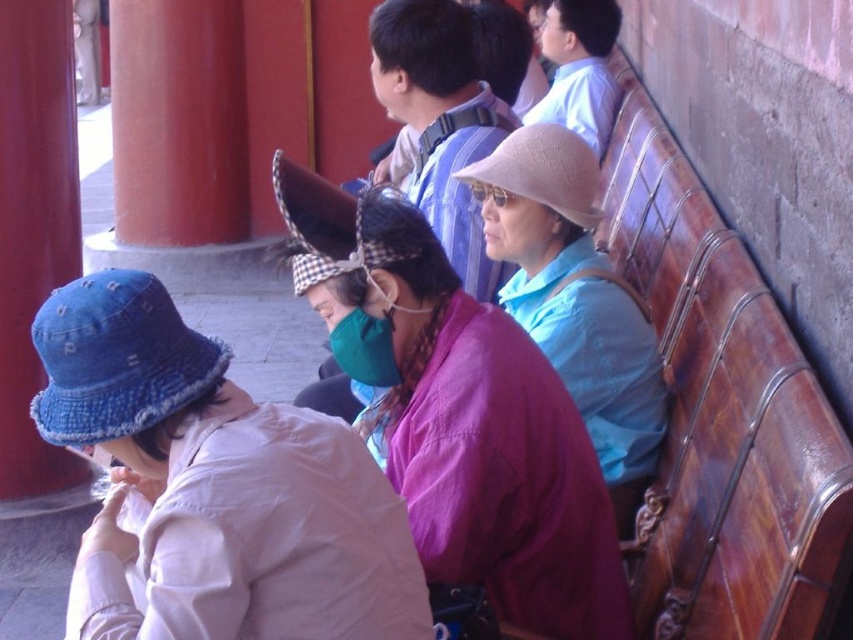
Looking at this image, is the position of denim hat at lower left more distant than that of purple fabric at center?

No, it is not.

Between denim hat at lower left and purple fabric at center, which one is positioned lower?

denim hat at lower left

Who is more forward, (282,563) or (412,216)?

Point (282,563) is in front.

The width and height of the screenshot is (853, 640). I want to click on denim hat at lower left, so click(x=213, y=486).

Is purple fabric at center thinner than smooth red pillar at left?

In fact, purple fabric at center might be wider than smooth red pillar at left.

Looking at this image, is purple fabric at center bigger than smooth red pillar at left?

Yes.

Does point (599, 582) come in front of point (70, 54)?

Yes, point (599, 582) is in front of point (70, 54).

The width and height of the screenshot is (853, 640). Identify the location of purple fabric at center. (489, 449).

From the picture: Which of these two, denim hat at lower left or smooth red pillar at left, stands shorter?

denim hat at lower left

Does denim hat at lower left come in front of smooth red pillar at left?

Yes, it is.

Which is in front, point (305, 468) or point (24, 195)?

Point (305, 468) is in front.

Locate an element on the screen. denim hat at lower left is located at coordinates (213, 486).